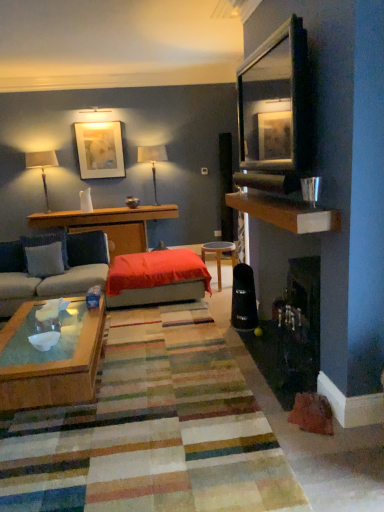
Question: Is wooden shelf at upper right wider or thinner than woodendesk at left?

Choices:
 (A) thin
 (B) wide

Answer: (A)

Question: Based on their sizes in the image, would you say wooden shelf at upper right is bigger or smaller than woodendesk at left?

Choices:
 (A) big
 (B) small

Answer: (B)

Question: Which object is the farthest from the matte white picture frame at upper center?

Choices:
 (A) wooden stool at center
 (B) matte white lampshade at upper left, placed as the 1th lamp when sorted from left to right
 (C) blue fabric pillow at left, the 2th pillow positioned from the front
 (D) wooden shelf at upper right
 (E) woodendesk at left

Answer: (D)

Question: Which object is the farthest from the matte white picture frame at upper center?

Choices:
 (A) woodendesk at left
 (B) white glossy bowl at center
 (C) clear glass cup at upper right
 (D) matte black lampshade at upper center, the 1th lamp viewed from the right
 (E) light blue fabric pillow at left, which is counted as the 2th pillow, starting from the back

Answer: (C)